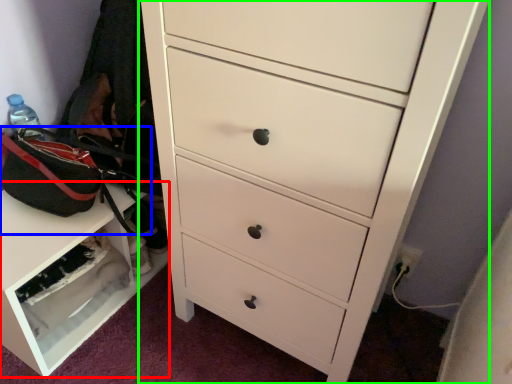
Question: Based on their relative distances, which object is nearer to cabinetry (highlighted by a red box)? Choose from messenger bag (highlighted by a blue box) and chest of drawers (highlighted by a green box).

Choices:
 (A) messenger bag
 (B) chest of drawers

Answer: (A)